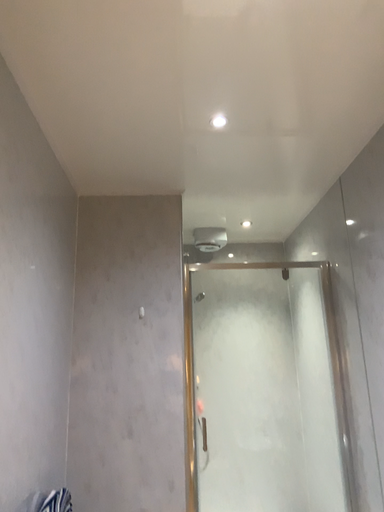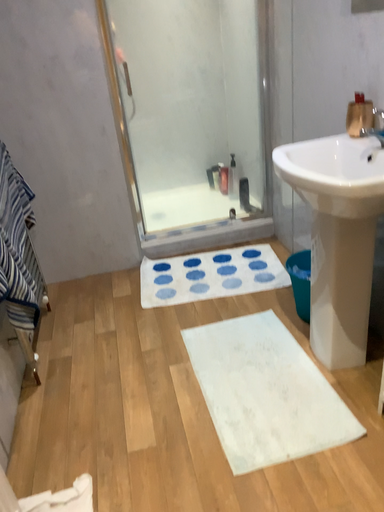
Question: How did the camera likely rotate when shooting the video?

Choices:
 (A) rotated downward
 (B) rotated upward

Answer: (A)